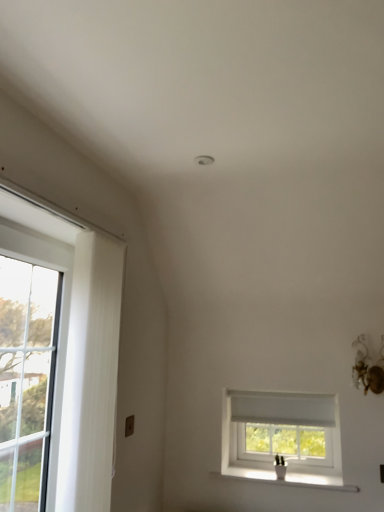
Question: Does white plastic window at center have a smaller size compared to white ceramic vase at lower right?

Choices:
 (A) no
 (B) yes

Answer: (A)

Question: Is white plastic window at center aimed at white ceramic vase at lower right?

Choices:
 (A) yes
 (B) no

Answer: (B)

Question: From a real-world perspective, is white plastic window at center below white ceramic vase at lower right?

Choices:
 (A) yes
 (B) no

Answer: (B)

Question: From the image's perspective, would you say white plastic window at center is shown under white ceramic vase at lower right?

Choices:
 (A) no
 (B) yes

Answer: (A)

Question: Can you confirm if white plastic window at center is positioned to the right of white ceramic vase at lower right?

Choices:
 (A) no
 (B) yes

Answer: (B)

Question: Considering the relative positions of white plastic window at center and white ceramic vase at lower right in the image provided, is white plastic window at center in front of white ceramic vase at lower right?

Choices:
 (A) no
 (B) yes

Answer: (A)

Question: Is white textured curtain at left taller than clear glass door at left?

Choices:
 (A) no
 (B) yes

Answer: (B)

Question: Can we say white textured curtain at left lies outside clear glass door at left?

Choices:
 (A) yes
 (B) no

Answer: (A)

Question: Can you confirm if white textured curtain at left is positioned to the right of clear glass door at left?

Choices:
 (A) no
 (B) yes

Answer: (B)

Question: Does white textured curtain at left come behind clear glass door at left?

Choices:
 (A) no
 (B) yes

Answer: (B)

Question: Would you say white textured curtain at left is a long distance from clear glass door at left?

Choices:
 (A) yes
 (B) no

Answer: (B)

Question: Is the depth of white textured curtain at left less than that of clear glass door at left?

Choices:
 (A) no
 (B) yes

Answer: (A)

Question: From the image's perspective, is clear glass door at left beneath white textured curtain at left?

Choices:
 (A) yes
 (B) no

Answer: (B)